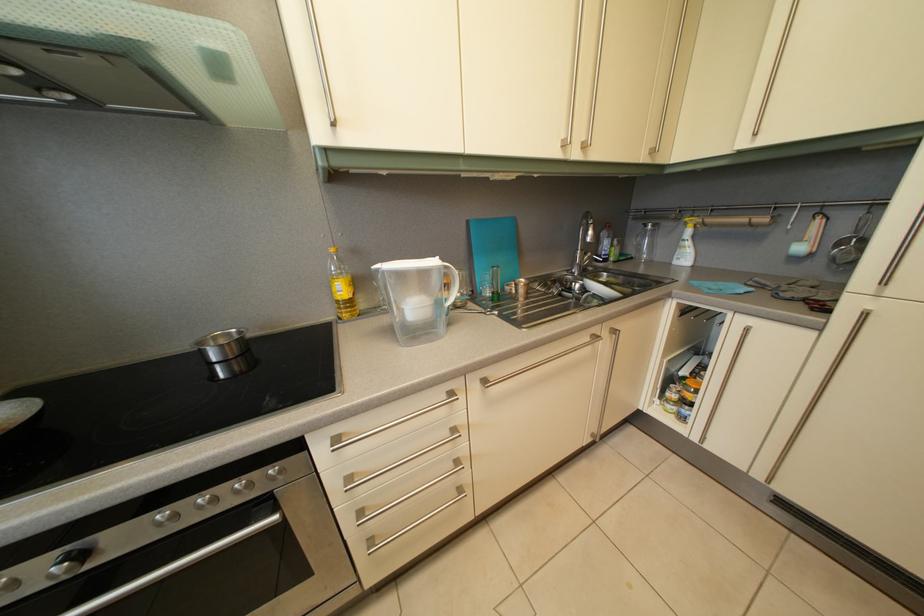
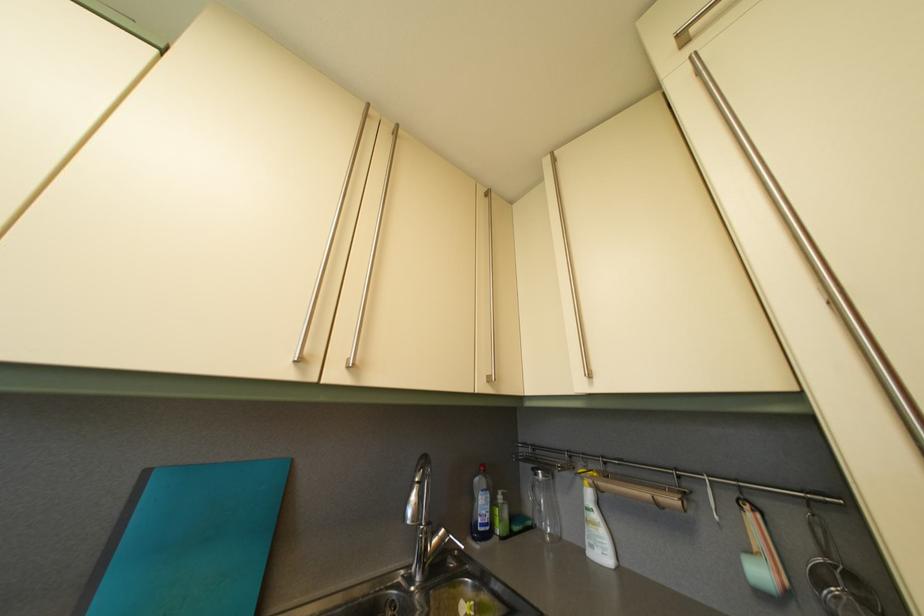
The point at (476, 229) is marked in the first image. Where is the corresponding point in the second image?

(154, 480)